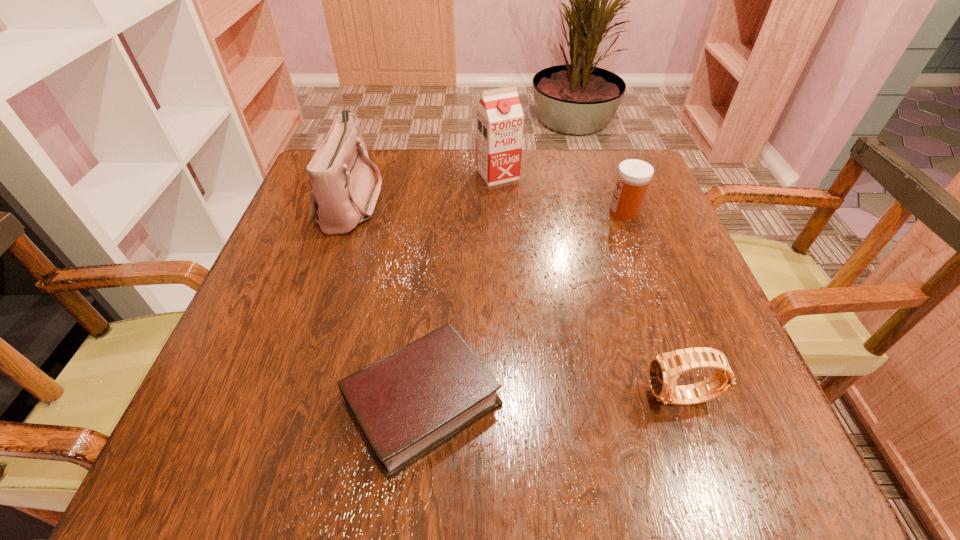
Image resolution: width=960 pixels, height=540 pixels. Find the location of `free space located on the face of the watch`. free space located on the face of the watch is located at coordinates click(x=392, y=398).

Image resolution: width=960 pixels, height=540 pixels. Identify the location of free space located on the face of the watch. pos(503,398).

Locate an element on the screen. vacant space positioned 0.350m on the right of the shortest object is located at coordinates (732, 401).

Where is `soya milk that is positioned at the far edge`? This screenshot has width=960, height=540. soya milk that is positioned at the far edge is located at coordinates pos(499,116).

This screenshot has width=960, height=540. Find the location of `shoulder bag located at the far edge`. shoulder bag located at the far edge is located at coordinates (343, 194).

Locate an element on the screen. This screenshot has height=540, width=960. medicine present at the far edge is located at coordinates (634, 175).

Image resolution: width=960 pixels, height=540 pixels. I want to click on watch present at the near edge, so click(664, 369).

Locate an element on the screen. Bible present at the near edge is located at coordinates (407, 403).

Locate an element on the screen. object at the left edge is located at coordinates (343, 194).

I want to click on medicine positioned at the right edge, so click(x=634, y=175).